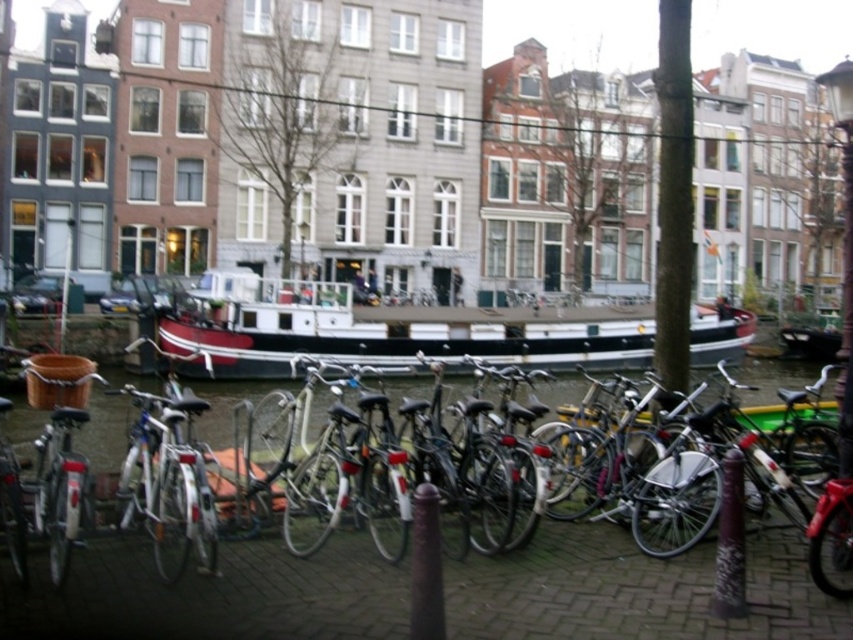
Question: Is white glossy boat at center bigger than shiny silver bicycle at center?

Choices:
 (A) no
 (B) yes

Answer: (B)

Question: Is white glossy boat at center to the right of shiny silver bicycle at center from the viewer's perspective?

Choices:
 (A) no
 (B) yes

Answer: (A)

Question: Can you confirm if white glossy boat at center is positioned to the right of shiny silver bicycle at center?

Choices:
 (A) no
 (B) yes

Answer: (A)

Question: Which point is closer to the camera taking this photo?

Choices:
 (A) (282, 570)
 (B) (282, 369)

Answer: (A)

Question: Which point appears farthest from the camera in this image?

Choices:
 (A) (531, 563)
 (B) (700, 339)

Answer: (B)